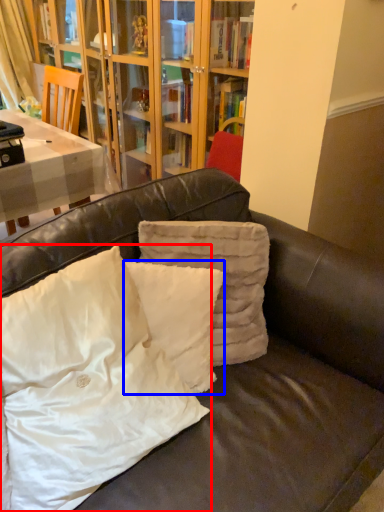
Question: Which object appears closest to the camera in this image, pillow (highlighted by a red box) or pillow (highlighted by a blue box)?

Choices:
 (A) pillow
 (B) pillow

Answer: (A)